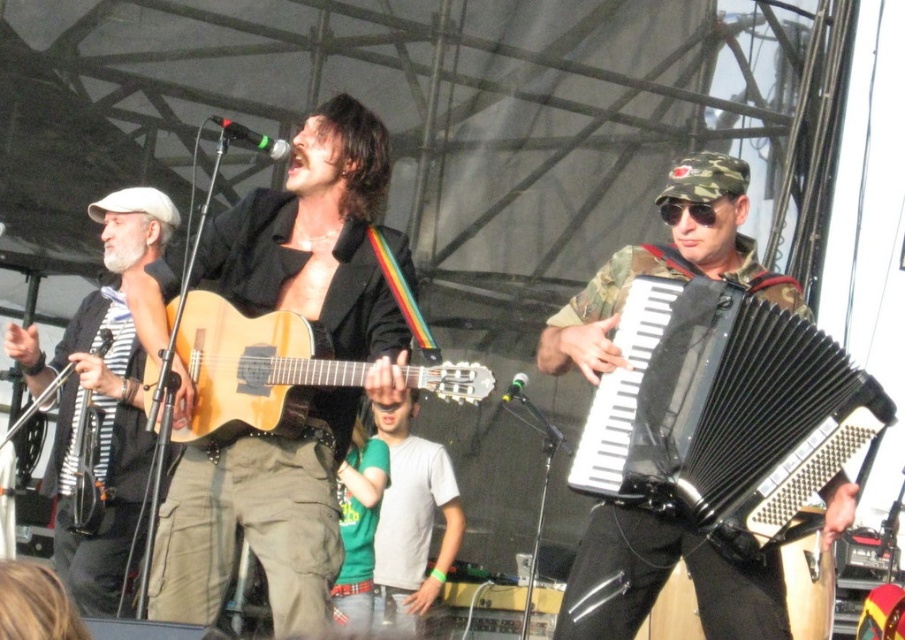
In the scene shown: Which is more to the left, black rubber accordion at right or natural wood acoustic guitar at center?

natural wood acoustic guitar at center

This screenshot has width=905, height=640. What do you see at coordinates (724, 412) in the screenshot? I see `black rubber accordion at right` at bounding box center [724, 412].

Which is behind, point (767, 417) or point (205, 390)?

The point (205, 390) is more distant.

Locate an element on the screen. Image resolution: width=905 pixels, height=640 pixels. black rubber accordion at right is located at coordinates (724, 412).

Is matte black guitar at center smaller than black rubber accordion at right?

Actually, matte black guitar at center might be larger than black rubber accordion at right.

I want to click on matte black guitar at center, so click(x=316, y=394).

Is black rubber accordion at right bigger than white striped shirt at left?

Actually, black rubber accordion at right might be smaller than white striped shirt at left.

From the picture: How distant is black rubber accordion at right from white striped shirt at left?

A distance of 3.70 meters exists between black rubber accordion at right and white striped shirt at left.

Describe the element at coordinates (724, 412) in the screenshot. I see `black rubber accordion at right` at that location.

Image resolution: width=905 pixels, height=640 pixels. Identify the location of black rubber accordion at right. (724, 412).